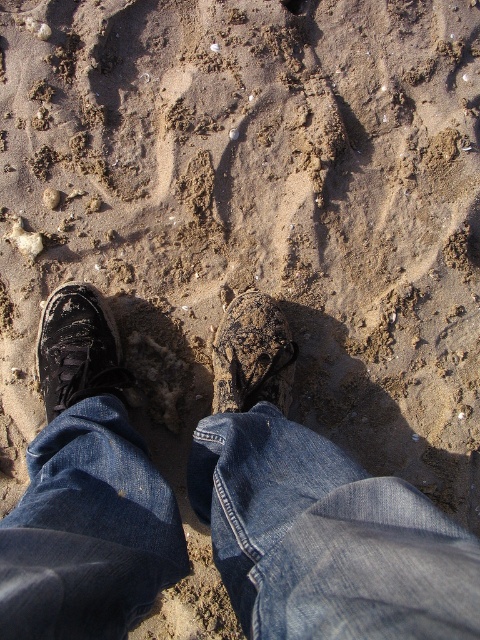
You are a photographer trying to capture the black leather shoe at lower left and the leather textured shoe at center in a single frame. Since you want both shoes to appear equally prominent, which shoe should you move closer to the camera?

You should move the leather textured shoe at center closer to the camera because the black leather shoe at lower left is bigger than the leather textured shoe at center, so bringing the smaller one closer can balance their sizes in the photo.

You are standing at the edge of the beach and see your black leather shoe at lower left. There is a seashell 4.52 feet away from it. Can you reach the seashell without moving your feet?

The seashell is 4.52 feet away from the black leather shoe at lower left. Since the average person can reach about 2 feet from their body, you would need to move your feet to reach the seashell.